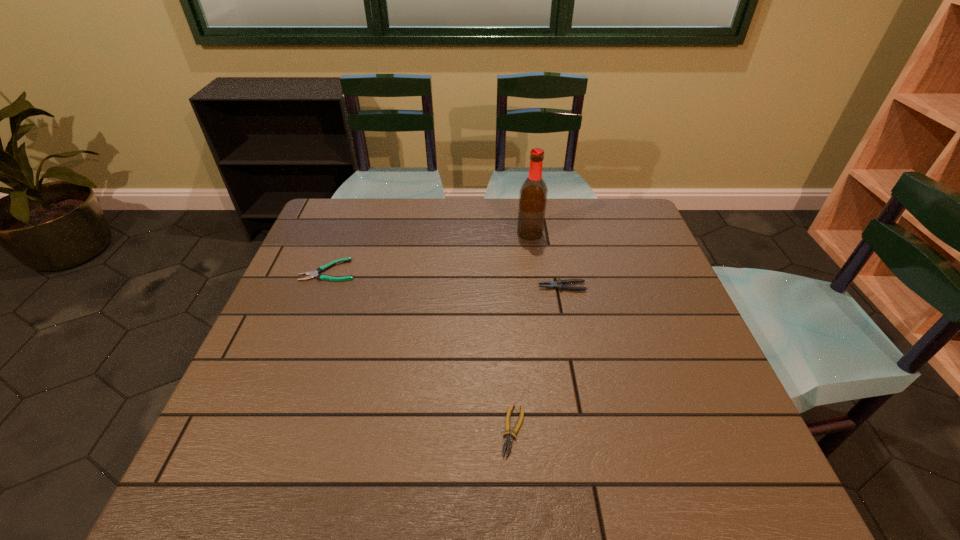
Locate an element on the screen. The width and height of the screenshot is (960, 540). beer bottle is located at coordinates (533, 194).

Find the location of a particular element. The image size is (960, 540). the farthest object is located at coordinates (533, 194).

Locate an element on the screen. This screenshot has height=540, width=960. the rightmost pliers is located at coordinates (559, 284).

The width and height of the screenshot is (960, 540). Find the location of `the tallest pliers`. the tallest pliers is located at coordinates (559, 284).

Where is `the leftmost pliers`? The width and height of the screenshot is (960, 540). the leftmost pliers is located at coordinates (312, 274).

Where is `the nearest pliers`? the nearest pliers is located at coordinates (508, 441).

The width and height of the screenshot is (960, 540). I want to click on the second pliers from right to left, so click(x=508, y=441).

Where is `free space located 0.390m on the front of the farthest object`? free space located 0.390m on the front of the farthest object is located at coordinates (545, 340).

You are a GUI agent. You are given a task and a screenshot of the screen. Output one action in this format:
    pyautogui.click(x=<x>, y=<y>)
    Task: Click on the free spot located at the gripping part of the tallest pliers
    The width and height of the screenshot is (960, 540).
    Given the screenshot: What is the action you would take?
    pyautogui.click(x=458, y=287)

At what (x,y) coordinates should I click in order to perform the action: click on vacant space located at the gripping part of the tallest pliers. Please return your answer as a coordinate pair (x, y). This screenshot has width=960, height=540. Looking at the image, I should click on (484, 287).